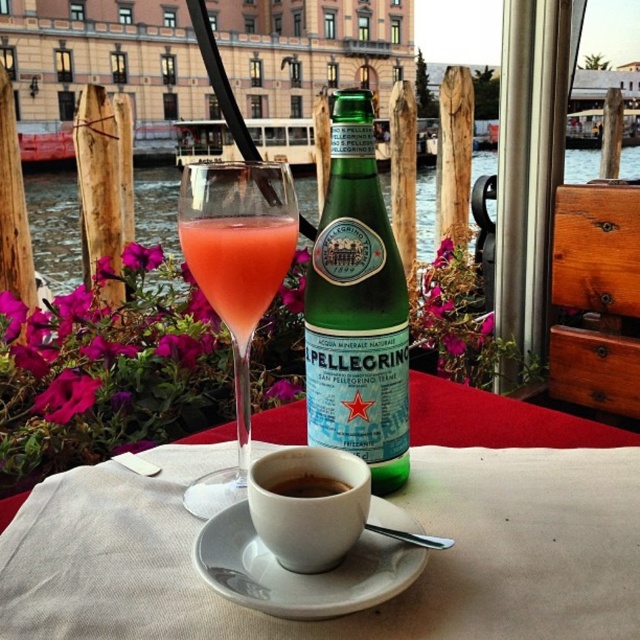
You are a waiter at the canal side restaurant. You see the translucent glass at center and the brown matte cup at center on the table. Which item is placed higher on the table?

The translucent glass at center is located above the brown matte cup at center, so the translucent glass at center is placed higher on the table.

You are a waiter at the canal side cafe. You need to place a new menu on the table which has the translucent glass at center and the brown matte cup at center. To ensure it doesn t fall off, where should you place the menu so it s stable?

The translucent glass at center is larger in size than the brown matte cup at center, so placing the menu next to the translucent glass at center would provide a more stable surface due to its larger base.

You are a barista preparing a drink and need to place the white ceramic saucer at center and the translucent glass at center on a shelf. Which one should you place first if you want to stack them vertically?

The white ceramic saucer at center has a lesser height compared to the translucent glass at center, so you should place the translucent glass at center first as it is taller and can support the saucer on top.